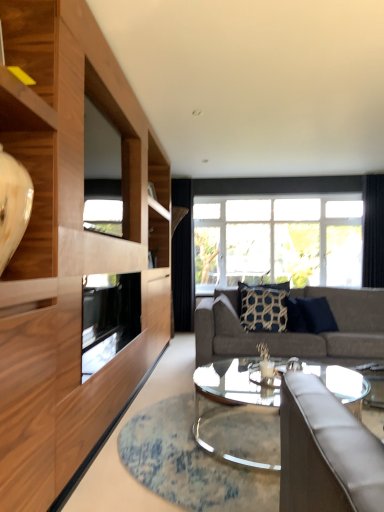
You are a GUI agent. You are given a task and a screenshot of the screen. Output one action in this format:
    pyautogui.click(x=<x>, y=<y>)
    Task: Click on the empty space that is ontop of transparent glass window screen at upper left (from a real-world perspective)
    This screenshot has height=512, width=384.
    Given the screenshot: What is the action you would take?
    pyautogui.click(x=97, y=103)